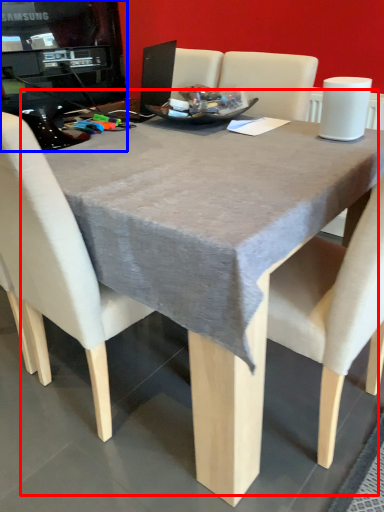
Question: Among these objects, which one is farthest to the camera, table (highlighted by a red box) or desktop computer (highlighted by a blue box)?

Choices:
 (A) table
 (B) desktop computer

Answer: (B)